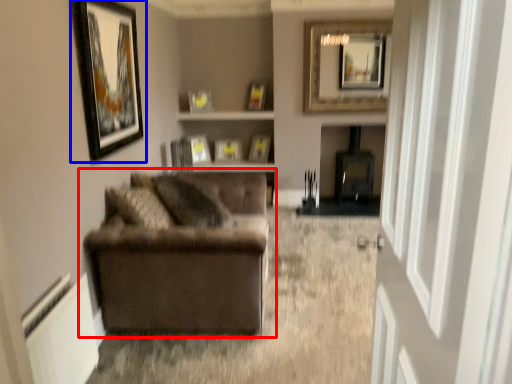
Question: Among these objects, which one is nearest to the camera, studio couch (highlighted by a red box) or picture frame (highlighted by a blue box)?

Choices:
 (A) studio couch
 (B) picture frame

Answer: (B)